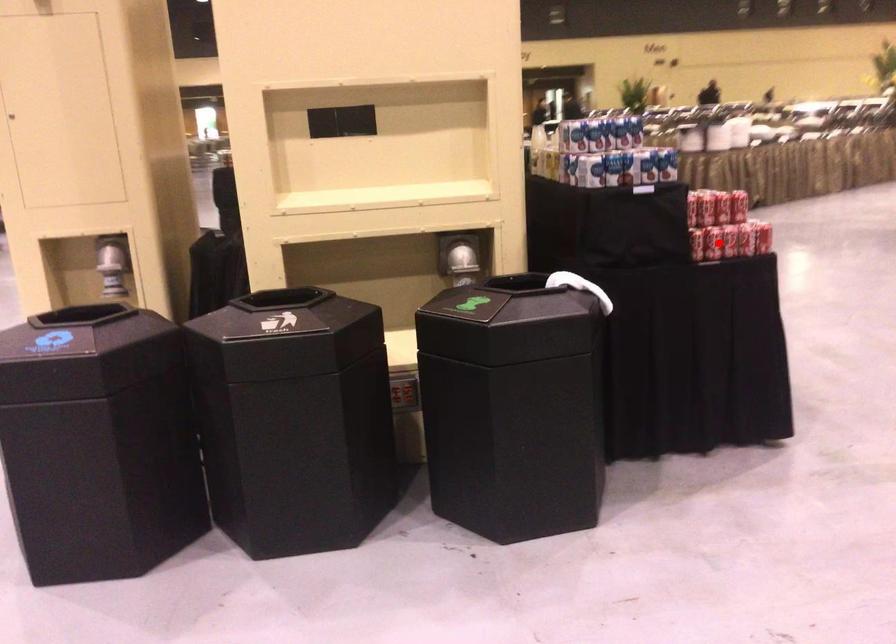
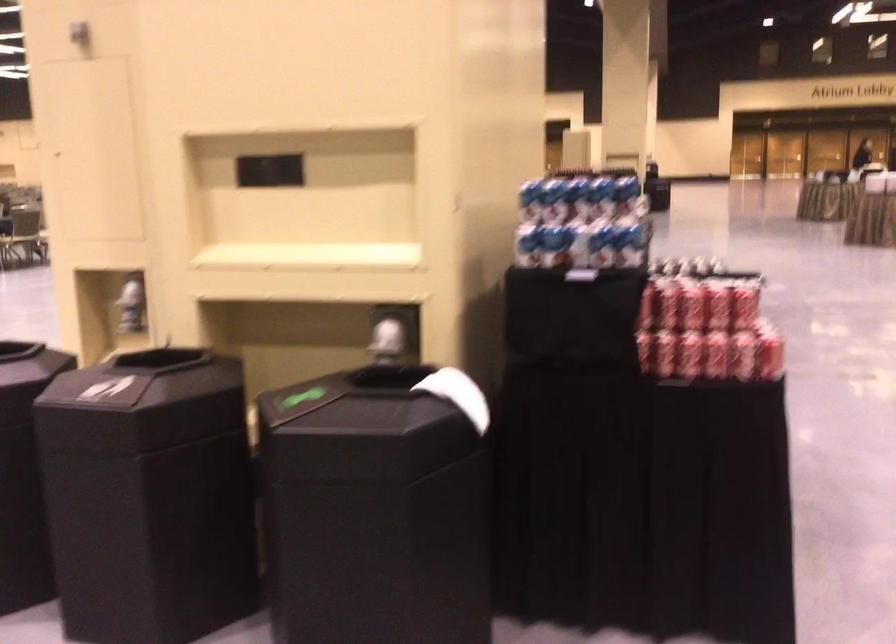
Where in the second image is the point corresponding to the highlighted location from the first image?

(688, 355)